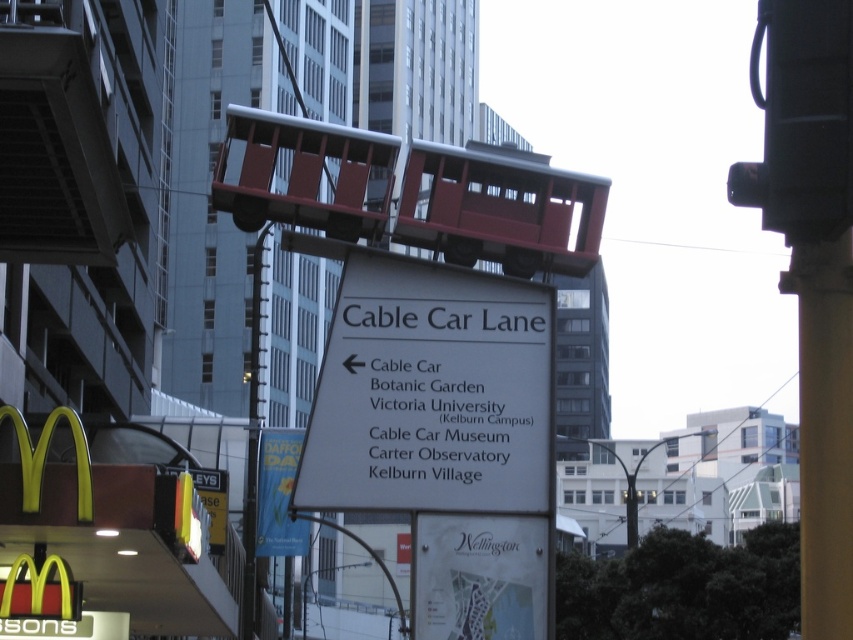
You are a tourist holding a white paper map at center and a yellow paper sign at center. You want to fold the map so it can fit into your pocket. Which object should you fold first to ensure both fit without overlapping?

The white paper map at center is positioned on the right side of yellow paper sign at center. Since the map is larger than the sign, you should fold the white paper map at center first to make space for both in your pocket.

You are a tourist holding a map and looking at the scene. The map shows a route that requires passing by both the yellow paper sign at center and the yellow plastic traffic light at lower left. Which object should you encounter first based on their positions?

The yellow plastic traffic light at lower left is positioned to the left of the yellow paper sign at center, so you would encounter the yellow plastic traffic light at lower left first as you move along the route.

You are a tourist holding a map and looking at the scene described. You notice the yellow paper sign at center and the yellow plastic traffic light at lower left. According to the map, which one is closer to you?

The yellow paper sign at center is closer to you because the yellow plastic traffic light at lower left is behind it.